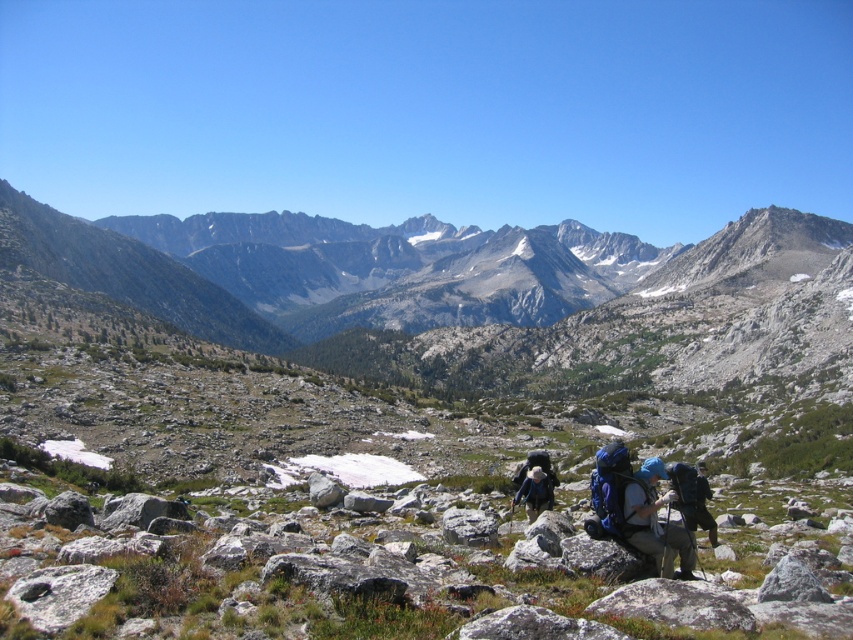
You are planning to place a small flag on the gray rough rock at lower left and the blue fabric backpack at center. Which object will require a shorter flag pole to place the flag at the same height as the other?

The gray rough rock at lower left is smaller than the blue fabric backpack at center, so placing the flag on the gray rough rock at lower left will require a shorter flag pole to reach the same height as the one on the blue fabric backpack at center.